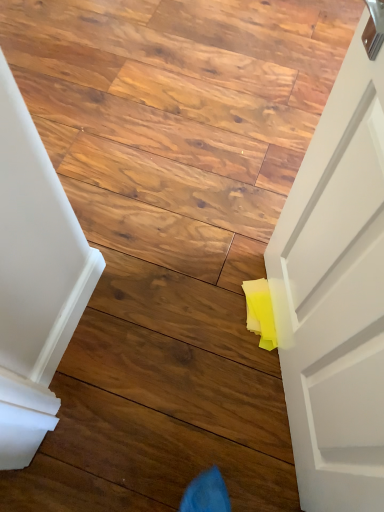
Identify the location of free space behind smooth wood plank at center. (168, 339).